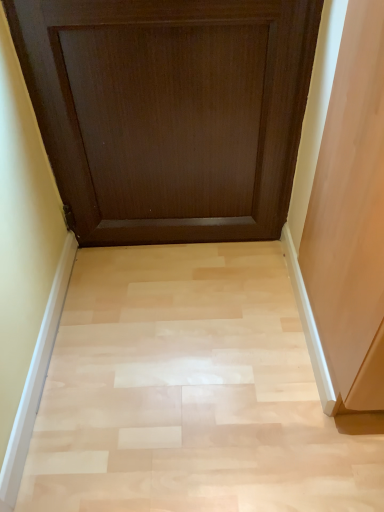
Image resolution: width=384 pixels, height=512 pixels. Find the location of `vacant space to the left of dark wood door at upper center`. vacant space to the left of dark wood door at upper center is located at coordinates (107, 288).